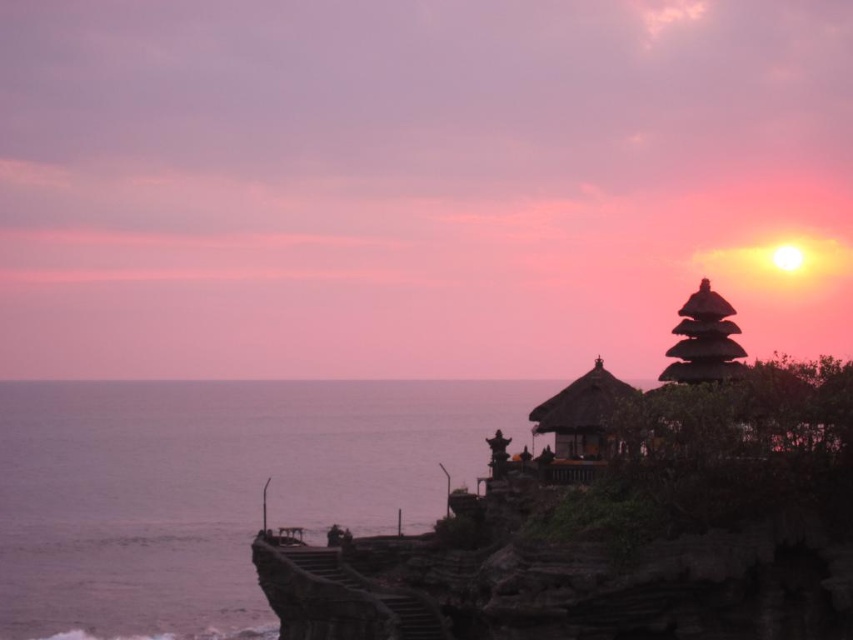
Is matte brown gazebo at center to the left of dark brown wooden gazebo at upper right from the viewer's perspective?

Correct, you'll find matte brown gazebo at center to the left of dark brown wooden gazebo at upper right.

Find the location of a particular element. matte brown gazebo at center is located at coordinates (581, 424).

Image resolution: width=853 pixels, height=640 pixels. Find the location of `matte brown gazebo at center`. matte brown gazebo at center is located at coordinates (581, 424).

Is silvery water at lower left bigger than dark brown wooden gazebo at upper right?

Yes.

Between silvery water at lower left and dark brown wooden gazebo at upper right, which one has more height?

silvery water at lower left

In order to click on silvery water at lower left in this screenshot , I will do tap(213, 490).

Is point (38, 461) in front of point (595, 419)?

That is False.

Is silvery water at lower left behind matte brown gazebo at center?

Yes, silvery water at lower left is behind matte brown gazebo at center.

Is point (4, 538) positioned behind point (549, 403)?

Yes, point (4, 538) is farther from viewer.

Image resolution: width=853 pixels, height=640 pixels. Identify the location of silvery water at lower left. (213, 490).